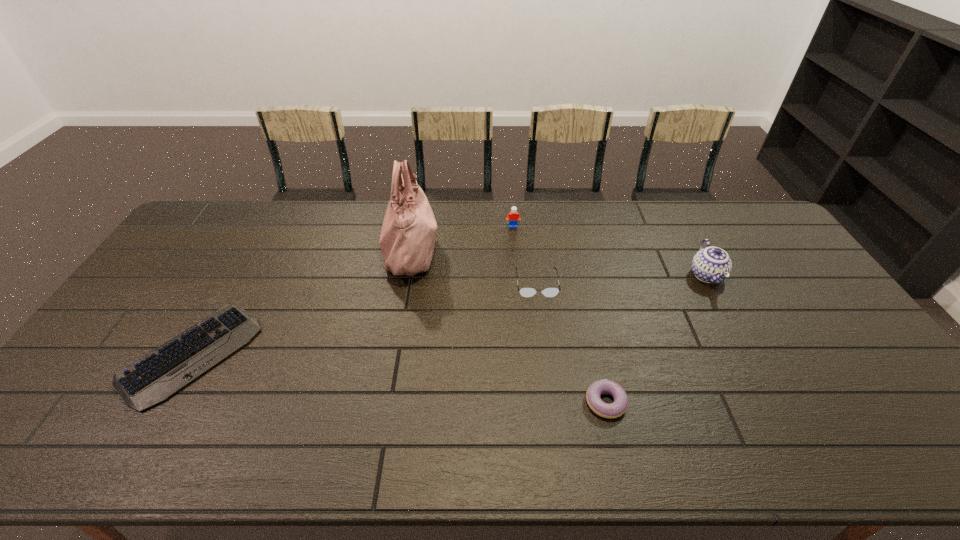
This screenshot has width=960, height=540. In order to click on the tallest object in this screenshot , I will do `click(407, 239)`.

This screenshot has height=540, width=960. What are the coordinates of `handbag` in the screenshot? It's located at (407, 239).

You are a GUI agent. You are given a task and a screenshot of the screen. Output one action in this format:
    pyautogui.click(x=<x>, y=<y>)
    Task: Click on the fifth shortest object
    
    Given the screenshot: What is the action you would take?
    (712, 265)

At what (x,y) coordinates should I click in order to perform the action: click on the rightmost object. Please return your answer as a coordinate pair (x, y). This screenshot has height=540, width=960. Looking at the image, I should click on (712, 265).

In order to click on Lego in this screenshot , I will do `click(513, 217)`.

Where is `spectacles`? spectacles is located at coordinates (526, 291).

I want to click on doughnut, so click(619, 406).

Where is `the fifth tallest object`? the fifth tallest object is located at coordinates (619, 406).

The width and height of the screenshot is (960, 540). Find the location of `the leftmost object`. the leftmost object is located at coordinates (156, 376).

Where is `the shortest object`? the shortest object is located at coordinates (156, 376).